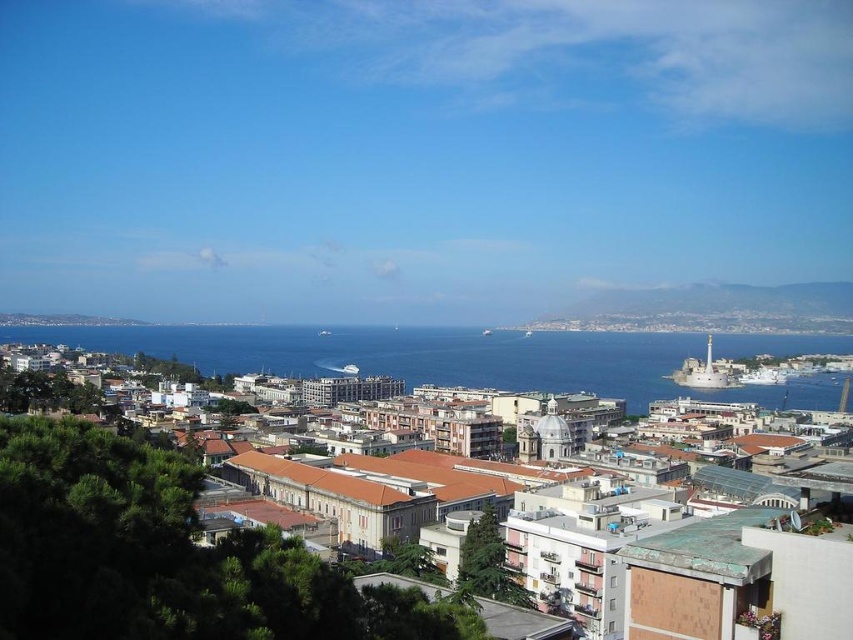
Question: Is green grassy hillside at upper right behind white glossy cruise ship at center-right?

Choices:
 (A) no
 (B) yes

Answer: (B)

Question: Estimate the real-world distances between objects in this image. Which object is closer to the blue water at center?

Choices:
 (A) white glossy cruise ship at center-right
 (B) green grassy hillside at upper right

Answer: (B)

Question: Which object appears closest to the camera in this image?

Choices:
 (A) blue water at center
 (B) green grassy hillside at upper right
 (C) white glossy cruise ship at center-right

Answer: (A)

Question: From the image, what is the correct spatial relationship of green grassy hillside at upper right in relation to white glossy cruise ship at center-right?

Choices:
 (A) above
 (B) below

Answer: (A)

Question: Can you confirm if blue water at center is positioned above green grassy hillside at upper right?

Choices:
 (A) no
 (B) yes

Answer: (A)

Question: Based on their relative distances, which object is nearer to the blue water at center?

Choices:
 (A) green grassy hillside at upper right
 (B) white glossy cruise ship at center-right

Answer: (A)